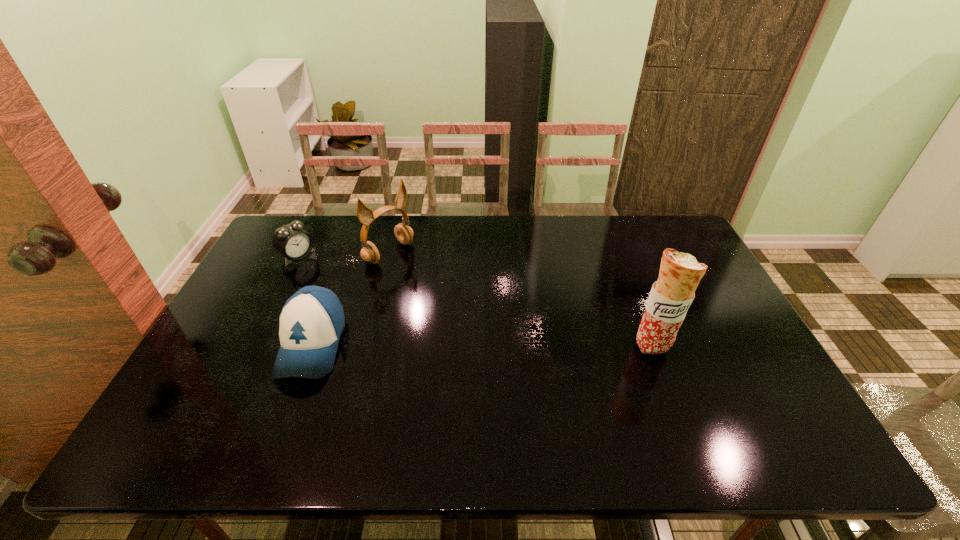
Find the location of a particular element. vacant region located on the front side of the alarm clock is located at coordinates (336, 281).

What are the coordinates of `vacant region located on the front side of the alarm clock` in the screenshot? It's located at (391, 314).

The image size is (960, 540). I want to click on earphone that is positioned at the far edge, so click(369, 252).

Locate an element on the screen. The image size is (960, 540). alarm clock located in the far edge section of the desktop is located at coordinates tap(292, 241).

Where is `object that is at the near edge`? object that is at the near edge is located at coordinates (312, 320).

You are a GUI agent. You are given a task and a screenshot of the screen. Output one action in this format:
    pyautogui.click(x=<x>, y=<y>)
    Task: Click on the object that is at the left edge
    
    Given the screenshot: What is the action you would take?
    pyautogui.click(x=292, y=241)

I want to click on object present at the far left corner, so click(292, 241).

The image size is (960, 540). What are the coordinates of `vacant space at the far edge of the desktop` in the screenshot? It's located at (444, 216).

Locate an element on the screen. The width and height of the screenshot is (960, 540). vacant region at the near edge of the desktop is located at coordinates (255, 383).

You are a GUI agent. You are given a task and a screenshot of the screen. Output one action in this format:
    pyautogui.click(x=<x>, y=<y>)
    Task: Click on the vacant space at the left edge
    
    Given the screenshot: What is the action you would take?
    pyautogui.click(x=252, y=362)